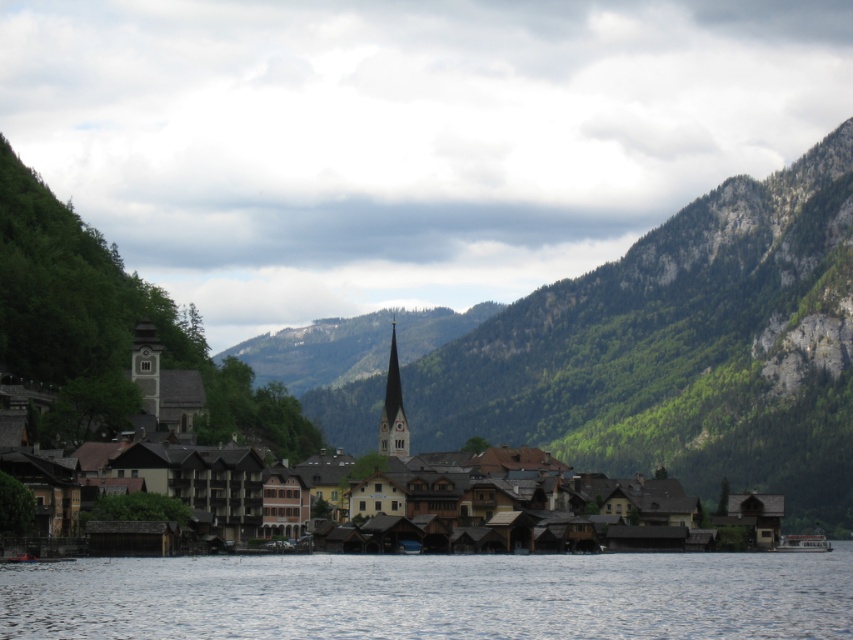
You are a visitor standing at the lakeside in the village. You see the transparent water at lower center and the white plastic boat at lower right. Which object is closer to your left side?

The transparent water at lower center is to the left of the white plastic boat at lower right, so it is closer to your left side.

You are a tourist standing at the lakeside and want to take a photo of the smooth light brown spire at center without the brown wooden houses at center blocking the view. Is there a way to do this?

The brown wooden houses at center are in front of the smooth light brown spire at center, so you would need to move to a position where the houses are not between you and the spire. Perhaps moving to the side or further back might allow you to frame the spire without obstruction.

You are a drone operator tasked with capturing aerial footage of the lakeside village. Your drone has a maximum flight range of 80 meters. If you are currently positioned over the transparent water at lower center, can you fly your drone to the smooth light brown spire at center without exceeding its range?

The distance between the transparent water at lower center and the smooth light brown spire at center is 78.08 meters, which is within the drone operator s 80 meter range. Therefore, the drone can safely fly to the smooth light brown spire at center without exceeding its maximum range.